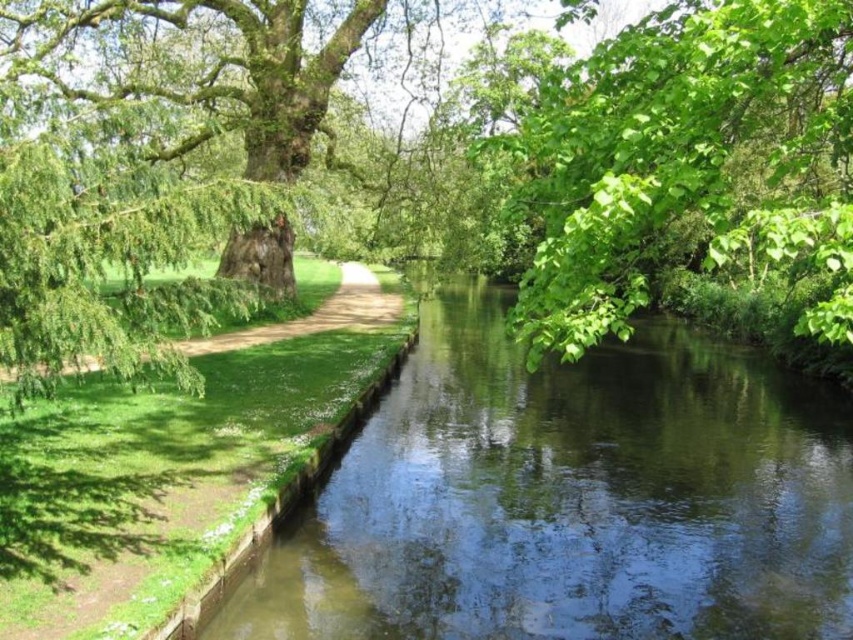
You are standing on the green grassy path at center and want to reach the green smooth water at center. Which direction should you move to get there?

You should move downward towards the green smooth water at center since it is located below the green grassy path at center.

You are planning to set up a picnic area in this scene. Considering the green leafy tree at upper right and the green grassy path at center, which area would provide more space for spreading out a picnic blanket?

The green leafy tree at upper right has a larger width than the green grassy path at center, so it would provide more space for spreading out a picnic blanket.